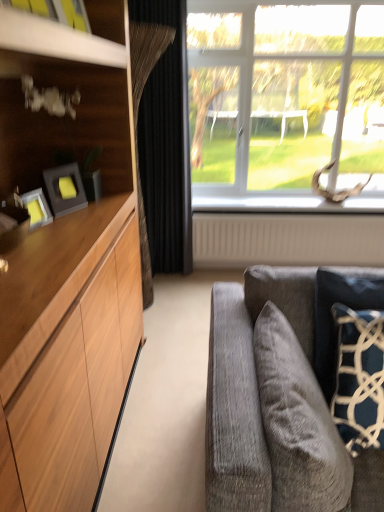
Where is `beige textured radiator at lower center`? The height and width of the screenshot is (512, 384). beige textured radiator at lower center is located at coordinates (286, 239).

The height and width of the screenshot is (512, 384). I want to click on matte black picture frame at left, so click(x=65, y=189).

Measure the distance between point [55,174] and camera.

The depth of point [55,174] is 5.78 feet.

Measure the distance between point (262, 352) and camera.

A distance of 1.42 meters exists between point (262, 352) and camera.

Where is `black velvet curtain at center`? The width and height of the screenshot is (384, 512). black velvet curtain at center is located at coordinates (166, 143).

Locate an element on the screen. dark blue textured pillow at right, which appears as the 2th pillow when viewed from the left is located at coordinates (333, 320).

Where is `clear glass window at upper right`? This screenshot has height=512, width=384. clear glass window at upper right is located at coordinates (284, 103).

Is black velvet curtain at center not inside dark blue textured pillow at right, which is counted as the first pillow, starting from the right?

black velvet curtain at center is positioned outside dark blue textured pillow at right, which is counted as the first pillow, starting from the right.

Is black velvet curtain at center in front of dark blue textured pillow at right, which is counted as the first pillow, starting from the right?

No, black velvet curtain at center is behind dark blue textured pillow at right, which is counted as the first pillow, starting from the right.

Are black velvet curtain at center and dark blue textured pillow at right, which is counted as the first pillow, starting from the right, far apart?

black velvet curtain at center is far away from dark blue textured pillow at right, which is counted as the first pillow, starting from the right.

Can you tell me how much black velvet curtain at center and dark blue textured pillow at right, which appears as the 2th pillow when viewed from the left, differ in facing direction?

They differ by 0.11 degrees in their facing directions.

Based on the photo, considering their positions, is beige textured radiator at lower center located in front of or behind black velvet curtain at center?

beige textured radiator at lower center is behind black velvet curtain at center.

The image size is (384, 512). In the image, there is a black velvet curtain at center. Identify the location of radiator below it (from a real-world perspective). pyautogui.click(x=286, y=239).

Between beige textured radiator at lower center and black velvet curtain at center, which one has larger size?

Bigger between the two is black velvet curtain at center.

Is beige textured radiator at lower center oriented away from black velvet curtain at center?

beige textured radiator at lower center does not have its back to black velvet curtain at center.

From the image's perspective, is dark blue textured pillow at right, which appears as the 2th pillow when viewed from the left, positioned above or below velvet gray pillow at lower right, which is counted as the 1th pillow, starting from the left?

Based on their image positions, dark blue textured pillow at right, which appears as the 2th pillow when viewed from the left, is located above velvet gray pillow at lower right, which is counted as the 1th pillow, starting from the left.

Which object is positioned more to the right, dark blue textured pillow at right, which appears as the 2th pillow when viewed from the left, or velvet gray pillow at lower right, the second pillow from the right?

From the viewer's perspective, dark blue textured pillow at right, which appears as the 2th pillow when viewed from the left, appears more on the right side.

Between dark blue textured pillow at right, which is counted as the first pillow, starting from the right, and velvet gray pillow at lower right, which is counted as the 1th pillow, starting from the left, which one has smaller size?

With smaller size is dark blue textured pillow at right, which is counted as the first pillow, starting from the right.

I want to click on curtain on the left of dark blue textured pillow at right, which is counted as the first pillow, starting from the right, so click(166, 143).

Is dark blue textured pillow at right, which is counted as the first pillow, starting from the right, not close to black velvet curtain at center?

Yes, dark blue textured pillow at right, which is counted as the first pillow, starting from the right, is far from black velvet curtain at center.

Does dark blue textured pillow at right, which is counted as the first pillow, starting from the right, come behind black velvet curtain at center?

No.

Based on the photo, considering the relative sizes of dark blue textured pillow at right, which appears as the 2th pillow when viewed from the left, and black velvet curtain at center in the image provided, is dark blue textured pillow at right, which appears as the 2th pillow when viewed from the left, bigger than black velvet curtain at center?

No.

From the image's perspective, between matte black picture frame at left and beige textured radiator at lower center, which one is located above?

matte black picture frame at left.

Considering the positions of objects matte black picture frame at left and beige textured radiator at lower center in the image provided, who is more to the left, matte black picture frame at left or beige textured radiator at lower center?

matte black picture frame at left is more to the left.

Which object is further away from the camera taking this photo, matte black picture frame at left or beige textured radiator at lower center?

beige textured radiator at lower center is more distant.

Is point (52, 192) less distant than point (272, 228)?

Yes, it is in front of point (272, 228).

Is beige textured radiator at lower center inside or outside of dark blue textured pillow at right, which is counted as the first pillow, starting from the right?

beige textured radiator at lower center is not inside dark blue textured pillow at right, which is counted as the first pillow, starting from the right, it's outside.

How many degrees apart are the facing directions of beige textured radiator at lower center and dark blue textured pillow at right, which appears as the 2th pillow when viewed from the left?

beige textured radiator at lower center and dark blue textured pillow at right, which appears as the 2th pillow when viewed from the left, are facing 0.11 degrees away from each other.

Consider the image. From a real-world perspective, which is physically above, beige textured radiator at lower center or dark blue textured pillow at right, which is counted as the first pillow, starting from the right?

In real-world perspective, dark blue textured pillow at right, which is counted as the first pillow, starting from the right, is above.

Is beige textured radiator at lower center far away from dark blue textured pillow at right, which is counted as the first pillow, starting from the right?

Yes, beige textured radiator at lower center and dark blue textured pillow at right, which is counted as the first pillow, starting from the right, are located far from each other.

Is dark blue textured pillow at right, which is counted as the first pillow, starting from the right, facing towards beige textured radiator at lower center?

No, dark blue textured pillow at right, which is counted as the first pillow, starting from the right, is not oriented towards beige textured radiator at lower center.

Is dark blue textured pillow at right, which is counted as the first pillow, starting from the right, directly adjacent to beige textured radiator at lower center?

No, dark blue textured pillow at right, which is counted as the first pillow, starting from the right, is not making contact with beige textured radiator at lower center.

From the picture: How distant is dark blue textured pillow at right, which appears as the 2th pillow when viewed from the left, from beige textured radiator at lower center?

6.02 feet.

Is dark blue textured pillow at right, which appears as the 2th pillow when viewed from the left, surrounding beige textured radiator at lower center?

No, beige textured radiator at lower center is not a part of dark blue textured pillow at right, which appears as the 2th pillow when viewed from the left.

Find the location of a particular element. The height and width of the screenshot is (512, 384). curtain behind the dark blue textured pillow at right, which appears as the 2th pillow when viewed from the left is located at coordinates (166, 143).

I want to click on curtain above the beige textured radiator at lower center (from the image's perspective), so click(x=166, y=143).

Estimate the real-world distances between objects in this image. Which object is further from matte black picture frame at left, beige textured radiator at lower center or clear glass window at upper right?

clear glass window at upper right is positioned further to the anchor matte black picture frame at left.

Based on their spatial positions, is dark blue textured pillow at right, which appears as the 2th pillow when viewed from the left, or black velvet curtain at center further from clear glass window at upper right?

Based on the image, dark blue textured pillow at right, which appears as the 2th pillow when viewed from the left, appears to be further to clear glass window at upper right.

Estimate the real-world distances between objects in this image. Which object is closer to clear glass window at upper right, black velvet curtain at center or beige textured radiator at lower center?

beige textured radiator at lower center is closer to clear glass window at upper right.

Considering their positions, is matte black picture frame at left positioned further to dark blue textured pillow at right, which is counted as the first pillow, starting from the right, than black velvet curtain at center?

The object further to dark blue textured pillow at right, which is counted as the first pillow, starting from the right, is black velvet curtain at center.

Which object lies nearer to the anchor point dark blue textured pillow at right, which appears as the 2th pillow when viewed from the left, beige textured radiator at lower center or velvet gray pillow at lower right, which is counted as the 1th pillow, starting from the left?

velvet gray pillow at lower right, which is counted as the 1th pillow, starting from the left, is closer to dark blue textured pillow at right, which appears as the 2th pillow when viewed from the left.

Looking at the image, which one is located closer to beige textured radiator at lower center, dark blue textured pillow at right, which appears as the 2th pillow when viewed from the left, or matte black picture frame at left?

dark blue textured pillow at right, which appears as the 2th pillow when viewed from the left, is closer to beige textured radiator at lower center.

Considering their positions, is clear glass window at upper right positioned closer to dark blue textured pillow at right, which is counted as the first pillow, starting from the right, than black velvet curtain at center?

Based on the image, black velvet curtain at center appears to be nearer to dark blue textured pillow at right, which is counted as the first pillow, starting from the right.

When comparing their distances from matte black picture frame at left, does black velvet curtain at center or clear glass window at upper right seem closer?

black velvet curtain at center is closer to matte black picture frame at left.

Where is `picture frame between velvet gray pillow at lower right, the second pillow from the right, and clear glass window at upper right, along the z-axis`? The width and height of the screenshot is (384, 512). picture frame between velvet gray pillow at lower right, the second pillow from the right, and clear glass window at upper right, along the z-axis is located at coordinates (65, 189).

Where is `picture frame between dark blue textured pillow at right, which appears as the 2th pillow when viewed from the left, and black velvet curtain at center in the front-back direction`? picture frame between dark blue textured pillow at right, which appears as the 2th pillow when viewed from the left, and black velvet curtain at center in the front-back direction is located at coordinates (65, 189).

You are a GUI agent. You are given a task and a screenshot of the screen. Output one action in this format:
    pyautogui.click(x=<x>, y=<y>)
    Task: Click on the pillow between velvet gray pillow at lower right, which is counted as the 1th pillow, starting from the left, and clear glass window at upper right, along the z-axis
    
    Given the screenshot: What is the action you would take?
    pyautogui.click(x=333, y=320)

Locate an element on the screen. curtain between matte black picture frame at left and beige textured radiator at lower center in the front-back direction is located at coordinates (166, 143).